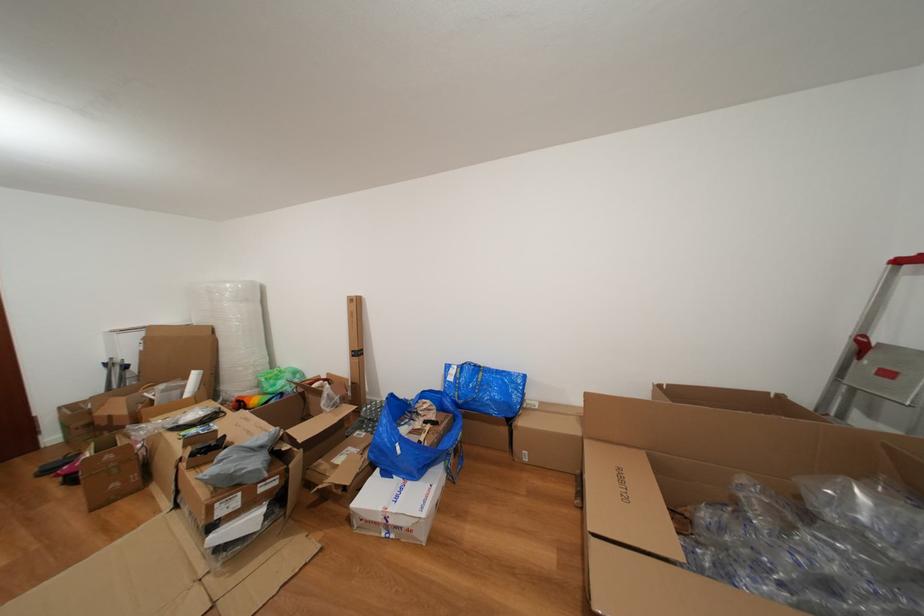
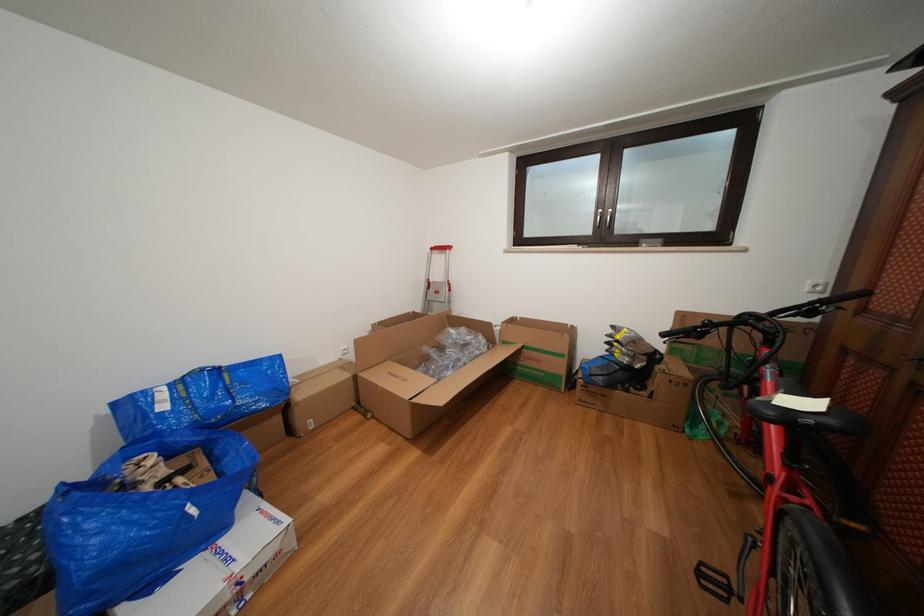
Locate, in the second image, the point that corresponds to point 399,400 in the first image.

(71, 490)